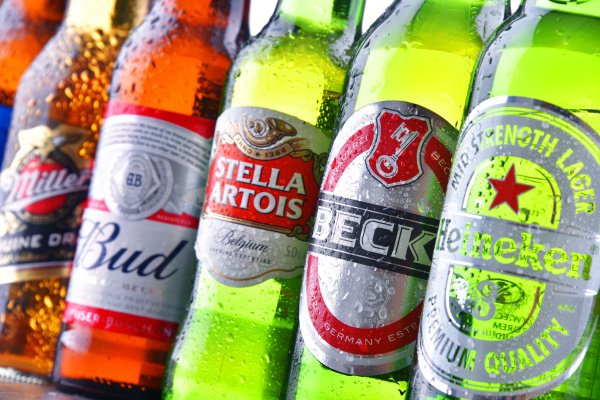
You are a GUI agent. You are given a task and a screenshot of the screen. Output one action in this format:
    pyautogui.click(x=<x>, y=<y>)
    Task: Click on the beer bottles
    This screenshot has height=400, width=600.
    Given the screenshot: What is the action you would take?
    pos(58,170), pos(134,198), pos(268,227), pos(348,226), pos(485,266)